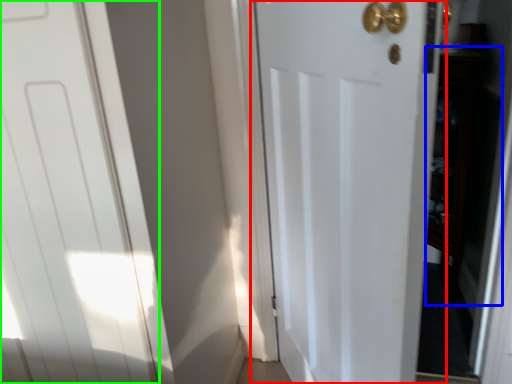
Question: Considering the real-world distances, which object is farthest from door (highlighted by a red box)? cabinetry (highlighted by a blue box) or door (highlighted by a green box)?

Choices:
 (A) cabinetry
 (B) door

Answer: (A)